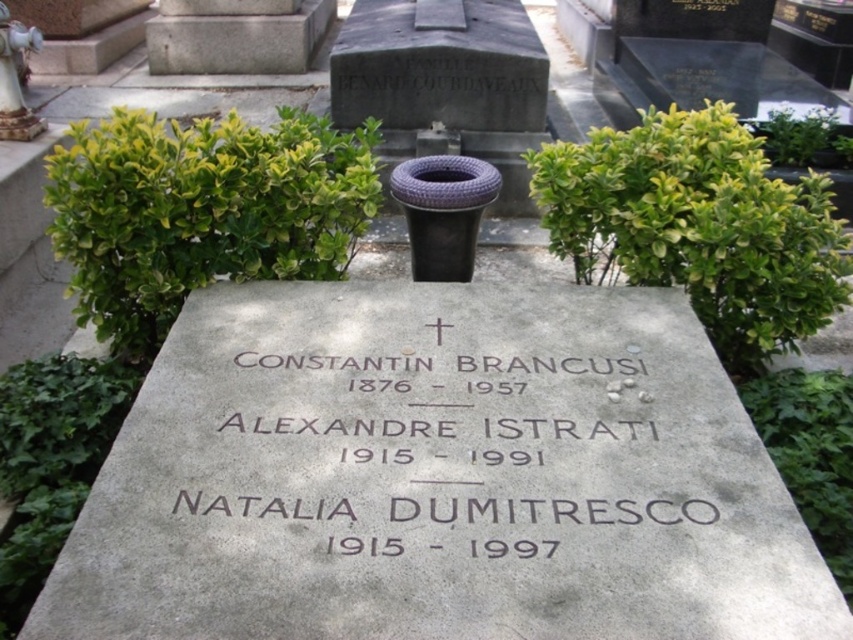
You are an archaeologist examining the cemetery scene. You need to determine which object is wider between the gray stone at upper center and the white ceramic statue at upper left. Can you identify which one is wider?

The gray stone at upper center is wider than the white ceramic statue at upper left according to the description provided.